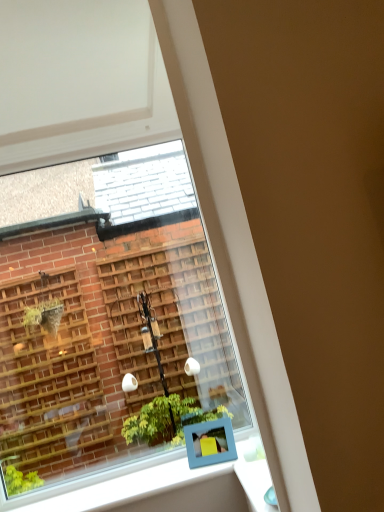
Question: From a real-world perspective, is white glossy window sill at lower center located beneath blue plastic frame at lower center?

Choices:
 (A) yes
 (B) no

Answer: (A)

Question: Considering the relative sizes of white glossy window sill at lower center and blue plastic frame at lower center in the image provided, is white glossy window sill at lower center smaller than blue plastic frame at lower center?

Choices:
 (A) no
 (B) yes

Answer: (A)

Question: Is white glossy window sill at lower center shorter than blue plastic frame at lower center?

Choices:
 (A) no
 (B) yes

Answer: (B)

Question: Is white glossy window sill at lower center wider than blue plastic frame at lower center?

Choices:
 (A) yes
 (B) no

Answer: (A)

Question: Is white glossy window sill at lower center positioned with its back to blue plastic frame at lower center?

Choices:
 (A) yes
 (B) no

Answer: (B)

Question: Does point (59, 77) appear closer or farther from the camera than point (246, 480)?

Choices:
 (A) farther
 (B) closer

Answer: (B)

Question: In the image, is clear glass window at upper left on the left side or the right side of white glossy window sill at lower center?

Choices:
 (A) left
 (B) right

Answer: (A)

Question: Is clear glass window at upper left bigger or smaller than white glossy window sill at lower center?

Choices:
 (A) small
 (B) big

Answer: (B)

Question: Is clear glass window at upper left inside the boundaries of white glossy window sill at lower center, or outside?

Choices:
 (A) inside
 (B) outside

Answer: (B)

Question: Considering the positions of blue plastic frame at lower center and white glossy window sill at lower center in the image, is blue plastic frame at lower center wider or thinner than white glossy window sill at lower center?

Choices:
 (A) wide
 (B) thin

Answer: (B)

Question: From the image's perspective, is blue plastic frame at lower center positioned above or below white glossy window sill at lower center?

Choices:
 (A) above
 (B) below

Answer: (A)

Question: Is blue plastic frame at lower center inside or outside of white glossy window sill at lower center?

Choices:
 (A) outside
 (B) inside

Answer: (A)

Question: From a real-world perspective, relative to white glossy window sill at lower center, is blue plastic frame at lower center vertically above or below?

Choices:
 (A) below
 (B) above

Answer: (B)

Question: From a real-world perspective, is clear glass window at upper left physically located above or below blue plastic frame at lower center?

Choices:
 (A) below
 (B) above

Answer: (B)

Question: Does point (4, 480) appear closer or farther from the camera than point (196, 429)?

Choices:
 (A) farther
 (B) closer

Answer: (A)